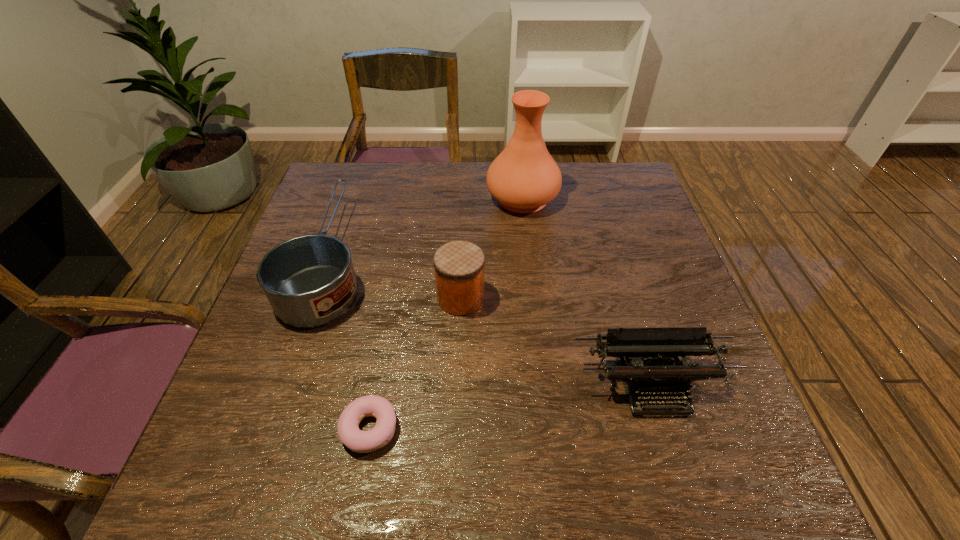
This screenshot has width=960, height=540. What are the coordinates of `vacant point located between the typewriter and the tallest object` in the screenshot? It's located at tap(587, 292).

This screenshot has height=540, width=960. I want to click on free area in between the fourth object from right to left and the saucepan, so click(x=350, y=344).

You are a GUI agent. You are given a task and a screenshot of the screen. Output one action in this format:
    pyautogui.click(x=<x>, y=<y>)
    Task: Click on the free space between the shortest object and the typewriter
    
    Given the screenshot: What is the action you would take?
    pyautogui.click(x=511, y=407)

The width and height of the screenshot is (960, 540). I want to click on vacant space that's between the typewriter and the saucepan, so click(x=492, y=322).

You are a GUI agent. You are given a task and a screenshot of the screen. Output one action in this format:
    pyautogui.click(x=<x>, y=<y>)
    Task: Click on the vacant point located between the vase and the shortest object
    
    Given the screenshot: What is the action you would take?
    pyautogui.click(x=446, y=313)

Find the location of a particular element. The image size is (960, 540). object identified as the second closest to the saucepan is located at coordinates (459, 266).

This screenshot has height=540, width=960. I want to click on the second closest object to the saucepan, so click(x=459, y=266).

Locate an element on the screen. This screenshot has height=540, width=960. free location that satisfies the following two spatial constraints: 1. with the handle extending from one side of the leftmost object; 2. on the left side of the vase is located at coordinates coord(351,198).

Identify the location of free region that satisfies the following two spatial constraints: 1. with the handle extending from one side of the leftmost object; 2. on the left side of the vase. (351, 198).